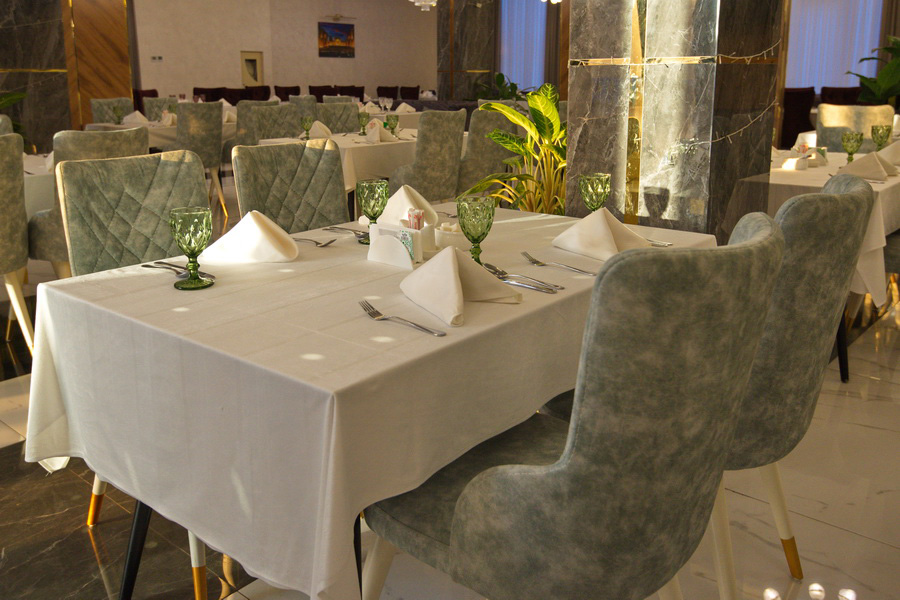
Image resolution: width=900 pixels, height=600 pixels. In order to click on table legs in this screenshot , I will do `click(727, 574)`, `click(778, 503)`, `click(194, 576)`, `click(95, 501)`, `click(847, 362)`.